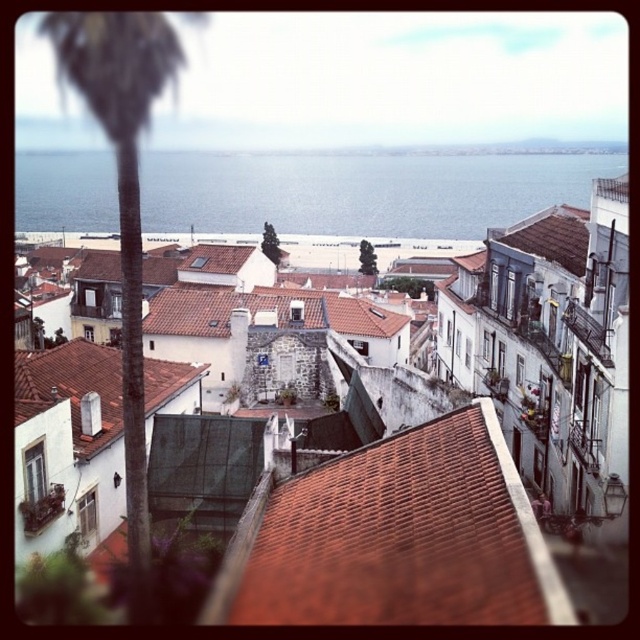
You are standing at the point with coordinates point [262,211] and want to walk towards the point with coordinates point [531,442]. Which direction should you face to walk directly towards your destination?

You should face towards the direction of point [531,442] because it is in front of point [262,211].

You are a tourist standing on the beach and want to take a photo of the brown tiled roof at center and the blue water at center in the same frame. Given that your camera can capture a maximum distance of 200 meters between objects, will you be able to include both in the photo?

The distance between the brown tiled roof at center and the blue water at center is 230.27 meters, which exceeds the camera maximum range of 200 meters. Therefore, you cannot capture both in the same frame.

You are standing on the beach and looking at the coastal town. Which roof, the matte white roof at center or the brown tile roof at upper right, would appear closer to you?

The matte white roof at center appears closer because it is in front of the brown tile roof at upper right.